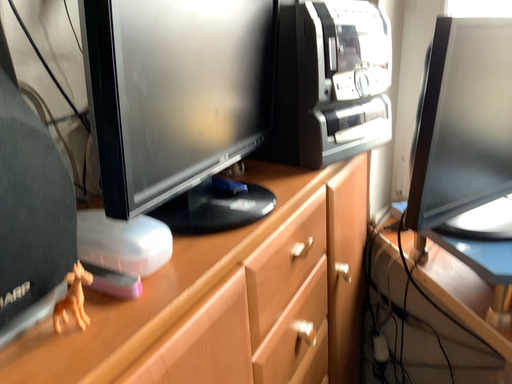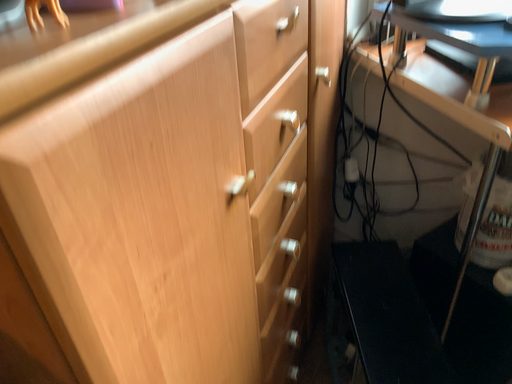
Question: How did the camera likely rotate when shooting the video?

Choices:
 (A) rotated downward
 (B) rotated upward

Answer: (A)